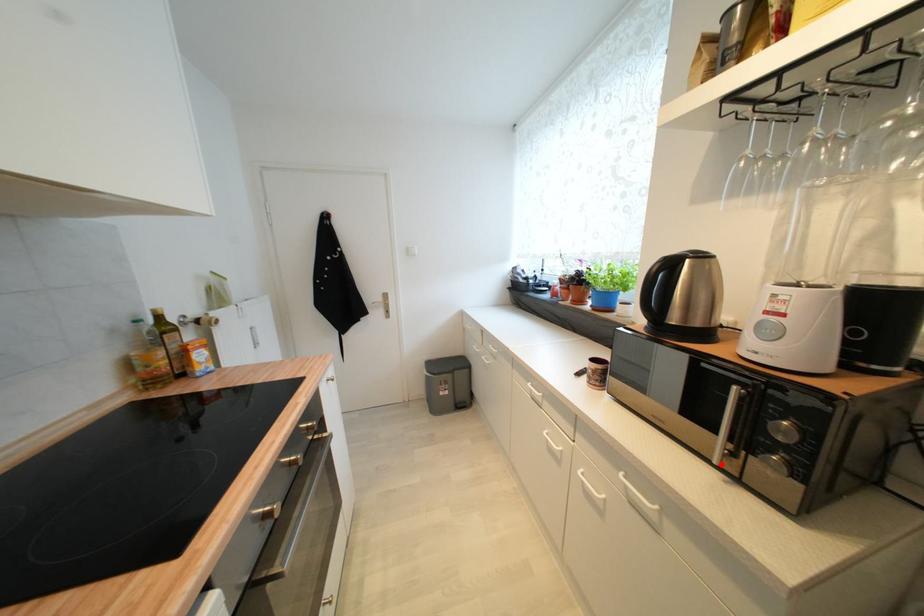
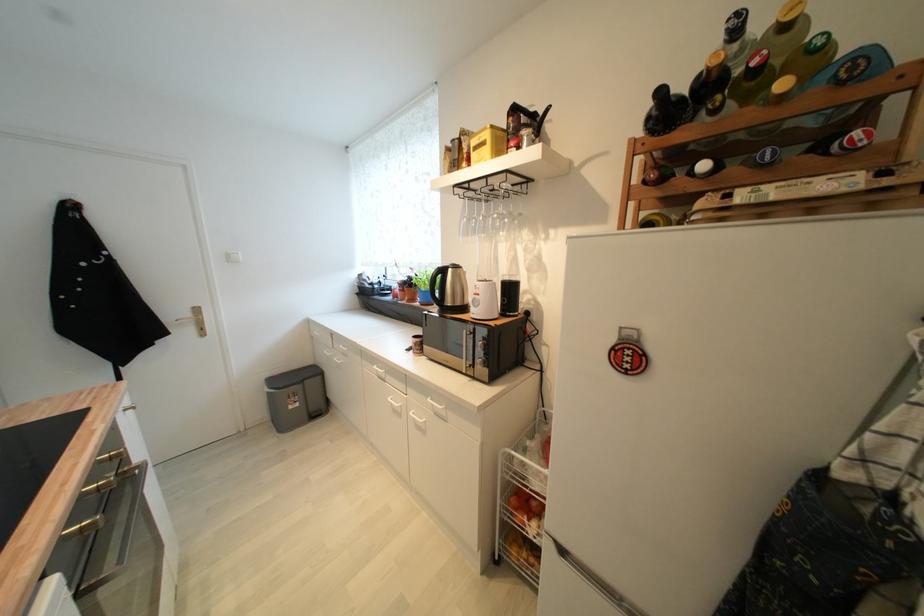
Locate, in the second image, the point that corresponds to the highlighted location in the first image.

(469, 374)